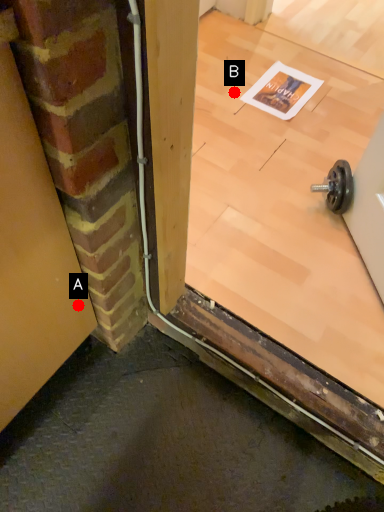
Question: Two points are circled on the image, labeled by A and B beside each circle. Among these points, which one is farthest from the camera?

Choices:
 (A) A is further
 (B) B is further

Answer: (B)